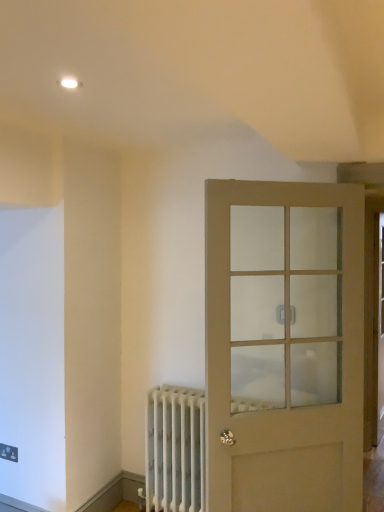
Measure the distance between point (301, 240) and camera.

The distance of point (301, 240) from camera is 7.44 feet.

Identify the location of matte beige door at right. (285, 344).

What do you see at coordinates (285, 344) in the screenshot? Image resolution: width=384 pixels, height=512 pixels. I see `matte beige door at right` at bounding box center [285, 344].

At what (x,y) coordinates should I click in order to perform the action: click on white metal radiator at lower left. Please return your answer as a coordinate pair (x, y). This screenshot has height=512, width=384. Looking at the image, I should click on (175, 449).

This screenshot has width=384, height=512. Describe the element at coordinates (175, 449) in the screenshot. I see `white metal radiator at lower left` at that location.

What are the coordinates of `matte beige door at right` in the screenshot? It's located at (285, 344).

Between matte beige door at right and white metal radiator at lower left, which one appears on the right side from the viewer's perspective?

matte beige door at right.

Is matte beige door at right positioned before white metal radiator at lower left?

Yes, matte beige door at right is in front of white metal radiator at lower left.

Which is in front, point (359, 296) or point (196, 398)?

Positioned in front is point (359, 296).

From the image's perspective, who appears lower, matte beige door at right or white metal radiator at lower left?

white metal radiator at lower left is shown below in the image.

From a real-world perspective, who is located lower, matte beige door at right or white metal radiator at lower left?

white metal radiator at lower left.

In the scene shown: Considering the sizes of matte beige door at right and white metal radiator at lower left in the image, is matte beige door at right wider or thinner than white metal radiator at lower left?

In the image, matte beige door at right appears to be more narrow than white metal radiator at lower left.

Which of these two, matte beige door at right or white metal radiator at lower left, stands taller?

matte beige door at right.

Considering the sizes of objects matte beige door at right and white metal radiator at lower left in the image provided, who is smaller, matte beige door at right or white metal radiator at lower left?

With smaller size is white metal radiator at lower left.

Can we say matte beige door at right lies outside white metal radiator at lower left?

Yes, matte beige door at right is located beyond the bounds of white metal radiator at lower left.

Is matte beige door at right far from white metal radiator at lower left?

No, there isn't a large distance between matte beige door at right and white metal radiator at lower left.

Is matte beige door at right facing away from white metal radiator at lower left?

Yes, matte beige door at right is facing away from white metal radiator at lower left.

How different are the orientations of matte beige door at right and white metal radiator at lower left in degrees?

matte beige door at right and white metal radiator at lower left are facing 37.8 degrees away from each other.

Where is `radiator behind the matte beige door at right`? radiator behind the matte beige door at right is located at coordinates (175, 449).

Can you confirm if white metal radiator at lower left is positioned to the left of matte beige door at right?

Yes.

Does white metal radiator at lower left lie in front of matte beige door at right?

No, white metal radiator at lower left is behind matte beige door at right.

Considering the points (173, 466) and (325, 200), which point is behind, point (173, 466) or point (325, 200)?

The point (173, 466) is farther.

From the image's perspective, is white metal radiator at lower left positioned above or below matte beige door at right?

From the image's perspective, white metal radiator at lower left appears below matte beige door at right.

From a real-world perspective, is white metal radiator at lower left positioned over matte beige door at right based on gravity?

No, from a real-world perspective, white metal radiator at lower left is not above matte beige door at right.

Is white metal radiator at lower left wider than matte beige door at right?

Indeed, white metal radiator at lower left has a greater width compared to matte beige door at right.

Which of these two, white metal radiator at lower left or matte beige door at right, stands shorter?

Standing shorter between the two is white metal radiator at lower left.

Does white metal radiator at lower left have a larger size compared to matte beige door at right?

No.

Would you say white metal radiator at lower left is inside or outside matte beige door at right?

white metal radiator at lower left exists outside the volume of matte beige door at right.

Would you consider white metal radiator at lower left to be distant from matte beige door at right?

That's not correct — white metal radiator at lower left is a little close to matte beige door at right.

Is white metal radiator at lower left turned away from matte beige door at right?

No, white metal radiator at lower left is not facing away from matte beige door at right.

What's the angular difference between white metal radiator at lower left and matte beige door at right's facing directions?

They differ by 37.8 degrees in their facing directions.

The width and height of the screenshot is (384, 512). I want to click on radiator located on the left of matte beige door at right, so click(175, 449).

Locate an element on the screen. The height and width of the screenshot is (512, 384). radiator located on the left of matte beige door at right is located at coordinates (175, 449).

Where is `door above the white metal radiator at lower left (from a real-world perspective)`? The height and width of the screenshot is (512, 384). door above the white metal radiator at lower left (from a real-world perspective) is located at coordinates (285, 344).